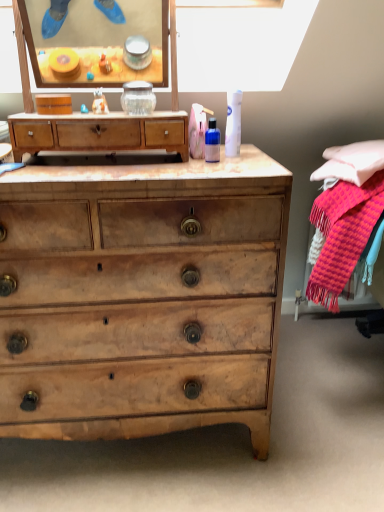
Locate an element on the screen. vacant space in front of light brown wooden chest of drawers at center, the second chest of drawers in the bottom-to-top sequence is located at coordinates (104, 168).